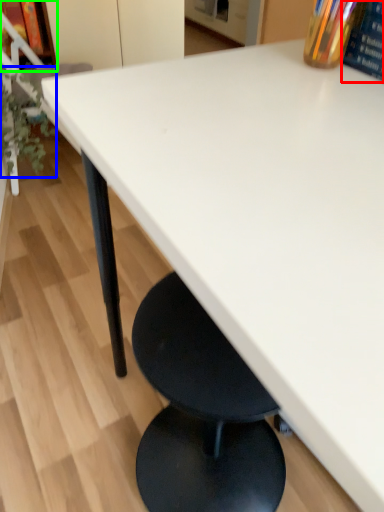
Question: Which is nearer to the paperback book (highlighted by a red box)? plant (highlighted by a blue box) or shelf (highlighted by a green box).

Choices:
 (A) plant
 (B) shelf

Answer: (A)